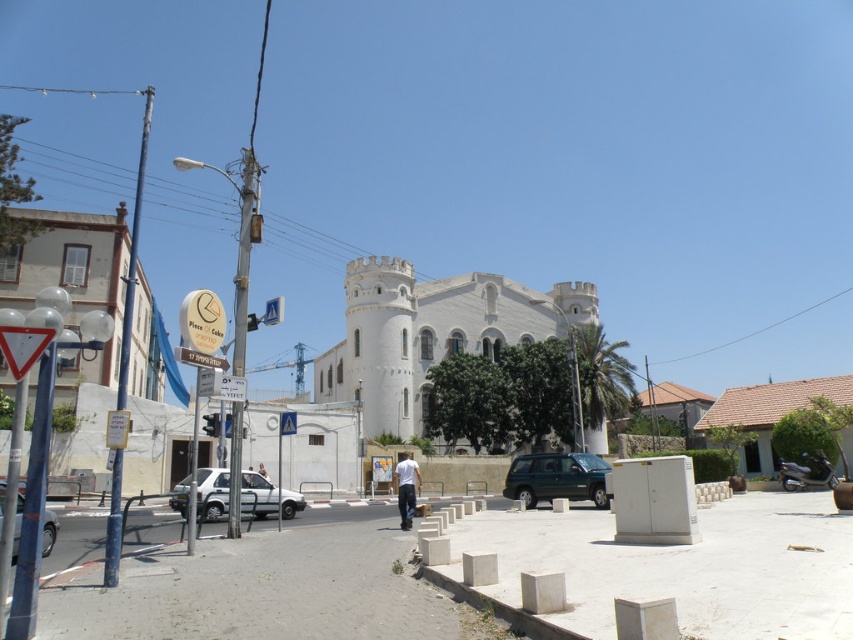
Question: Among these objects, which one is farthest from the camera?

Choices:
 (A) white plastic street sign at upper center
 (B) light brown leather jacket at center
 (C) white plastic sign at left
 (D) white matte car at lower left

Answer: (B)

Question: Does green matte suv at center appear on the left side of white cotton shirt at center?

Choices:
 (A) no
 (B) yes

Answer: (A)

Question: Is green matte suv at center below metallic silver car at lower left?

Choices:
 (A) yes
 (B) no

Answer: (A)

Question: Which is farther from the light brown leather jacket at center?

Choices:
 (A) green matte suv at center
 (B) white plastic sign at left

Answer: (B)

Question: Considering the relative positions of white matte car at lower left and white plastic street sign at upper center in the image provided, where is white matte car at lower left located with respect to white plastic street sign at upper center?

Choices:
 (A) below
 (B) above

Answer: (A)

Question: Which object appears closest to the camera in this image?

Choices:
 (A) white cotton shirt at center
 (B) white plastic street sign at upper center
 (C) white matte car at lower left
 (D) green matte suv at center

Answer: (B)